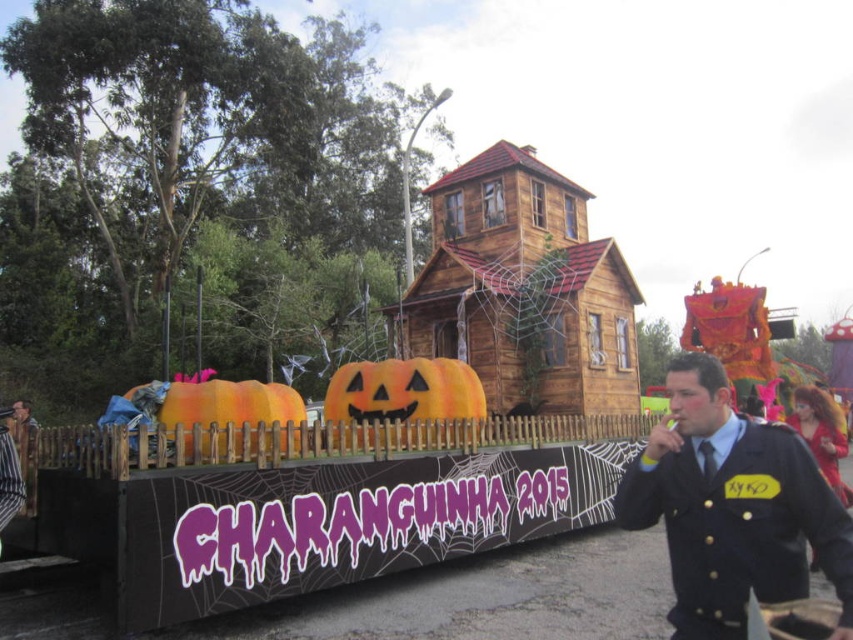
You are organizing a Halloween parade float and need to ensure that the black uniform at center and orange plush pumpkin at center are visible to the crowd. Since the float is narrow, you want to place the wider object on the left side to avoid blocking the smaller one. Which object should be placed on the left side?

The orange plush pumpkin at center should be placed on the left side because its width is greater than the black uniform at center, allowing the narrower black uniform to remain visible on the right.

You are standing in front of the float and want to take a photo of the black uniform at center. If your camera has a minimum focus distance of 2 meters, will you be able to take a clear photo?

The distance between the black uniform at center and the camera is 2.27 meters, which is greater than the minimum focus distance of 2 meters. Therefore, you can take a clear photo.

You are standing at the position of point (9, 458) and want to walk towards the float with the wooden house. Which direction should you go to reach the float without going behind point (679, 563)?

Since point (679, 563) is in front of point (9, 458), you should move forward towards the float while staying in front of point (679, 563) to reach the float without going behind it.